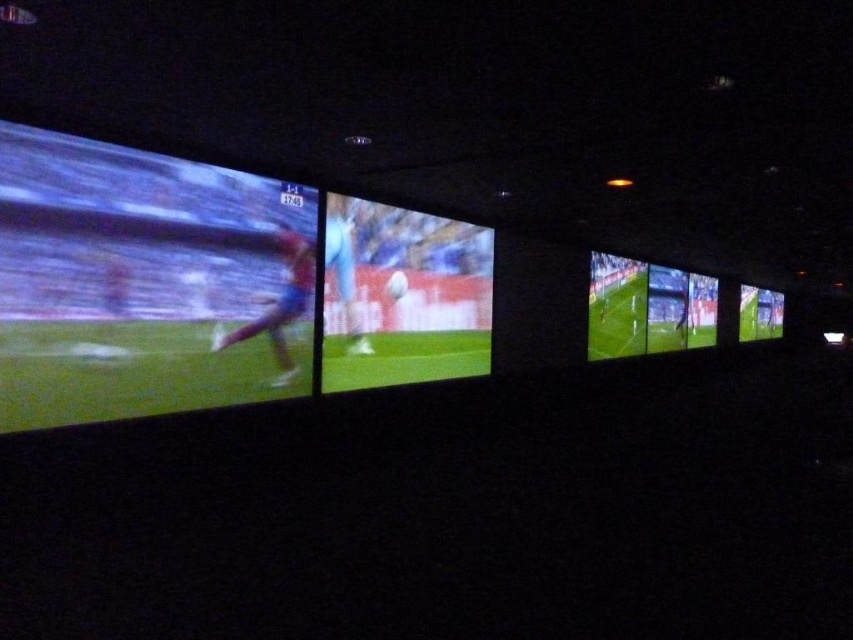
You are a photographer in the room and want to capture both the matte red soccer player at center and the light blue jersey at center in a single photo. Which object will appear bigger in the photo?

The matte red soccer player at center will appear bigger in the photo because it is larger in size than the light blue jersey at center.

You are in a dark room with multiple screens showing soccer matches. You notice a matte green screen at left and a matte red soccer player at center. Which object is closer to the left wall?

The matte green screen at left is closer to the left wall because it is positioned to the left of the matte red soccer player at center.

You are a photographer in the room and want to take a picture of the matte red soccer player at center and the light blue jersey at center. Which object should you focus on first if you want to capture both in one shot without adjusting your camera focus?

The matte red soccer player at center is shorter than the light blue jersey at center, so you should focus on the light blue jersey at center first since it is farther away and requires a greater depth of field to capture both objects clearly in one shot.